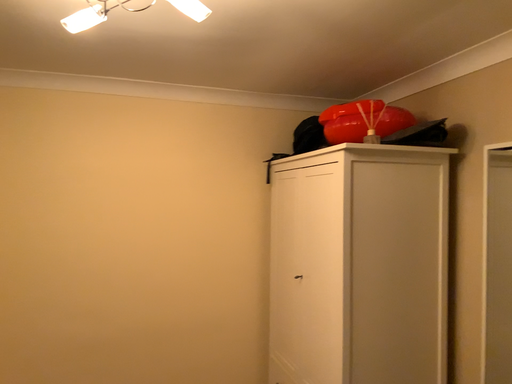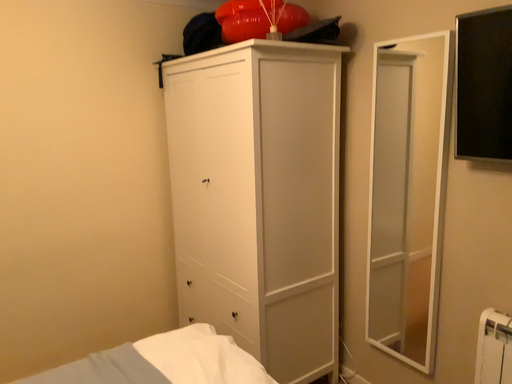
Question: Which way did the camera rotate in the video?

Choices:
 (A) rotated upward
 (B) rotated downward

Answer: (B)